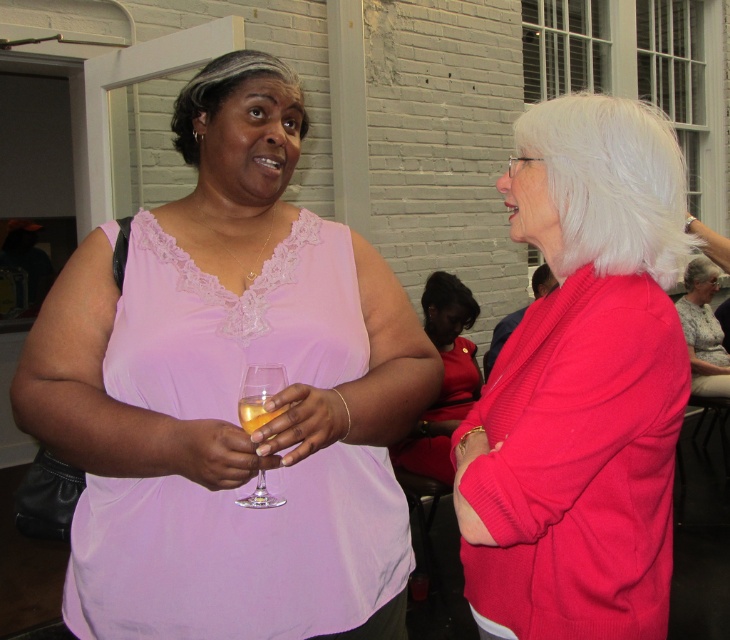
You are a photographer at the event and want to capture a closeup shot of both the gray synthetic wig at upper left and the translucent glass at center. Since you can only focus on one object at a time, which object should you focus on first to ensure it appears sharp in the photo?

The gray synthetic wig at upper left has a greater height compared to the translucent glass at center, so you should focus on the gray synthetic wig at upper left first because it is larger and more prominent in the frame.

You are at a party and want to take a photo of the two points in the image. The first point is at coordinates point (185, 99) and the second is at point (269, 412). Which point will appear closer to the camera in your photo?

Point (185, 99) will appear closer to the camera in the photo because it is further to the camera than point (269, 412) according to the description.